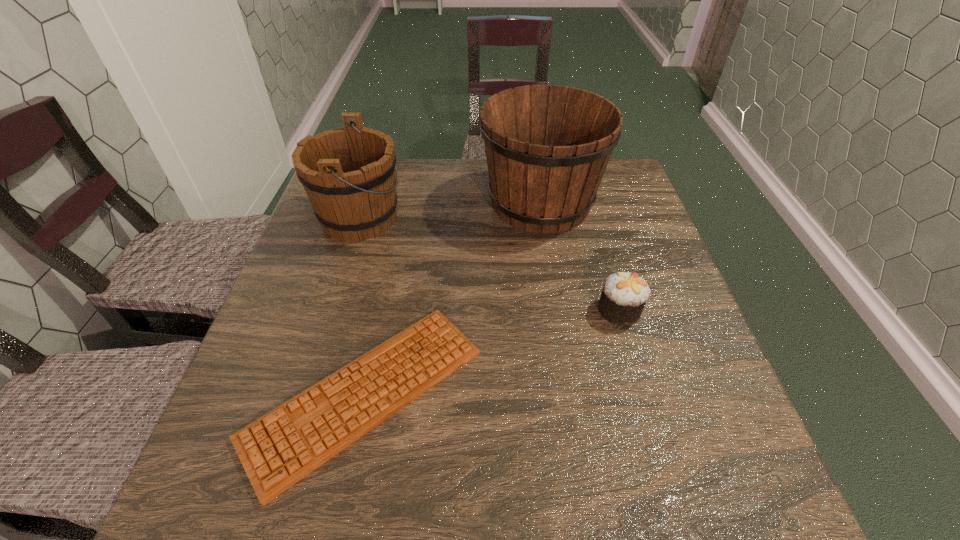
At what (x,y) coordinates should I click in order to perform the action: click on blank region between the third tallest object and the shortest object. Please return your answer as a coordinate pair (x, y). Looking at the image, I should click on (492, 352).

Select which object is the third closest to the shortest object. Please provide its 2D coordinates. Your answer should be formatted as a tuple, i.e. [(x, y)], where the tuple contains the x and y coordinates of a point satisfying the conditions above.

[(624, 295)]

Select which object is the third closest to the right wine bucket. Please provide its 2D coordinates. Your answer should be formatted as a tuple, i.e. [(x, y)], where the tuple contains the x and y coordinates of a point satisfying the conditions above.

[(280, 448)]

Image resolution: width=960 pixels, height=540 pixels. I want to click on vacant area that satisfies the following two spatial constraints: 1. on the side of the shortest object with the handle for carrying; 2. on the left side of the left wine bucket, so click(304, 394).

At what (x,y) coordinates should I click in order to perform the action: click on free space that satisfies the following two spatial constraints: 1. on the back side of the shortest object; 2. on the left side of the right wine bucket. Please return your answer as a coordinate pair (x, y). The height and width of the screenshot is (540, 960). Looking at the image, I should click on (404, 202).

The width and height of the screenshot is (960, 540). Identify the location of vacant region that satisfies the following two spatial constraints: 1. on the side of the left wine bucket with the handle for carrying; 2. on the left side of the third tallest object. (330, 310).

At what (x,y) coordinates should I click in order to perform the action: click on vacant region that satisfies the following two spatial constraints: 1. on the back side of the shortest object; 2. on the right side of the cupcake. Please return your answer as a coordinate pair (x, y). This screenshot has height=540, width=960. Looking at the image, I should click on (382, 310).

In order to click on vacant space that satisfies the following two spatial constraints: 1. on the front side of the right wine bucket; 2. on the right side of the second shortest object in this screenshot , I will do `click(559, 310)`.

Identify the location of vacant space that satisfies the following two spatial constraints: 1. on the side of the left wine bucket with the handle for carrying; 2. on the back side of the computer keyboard. The image size is (960, 540). (304, 394).

I want to click on free location that satisfies the following two spatial constraints: 1. on the side of the left wine bucket with the handle for carrying; 2. on the left side of the second shortest object, so click(330, 310).